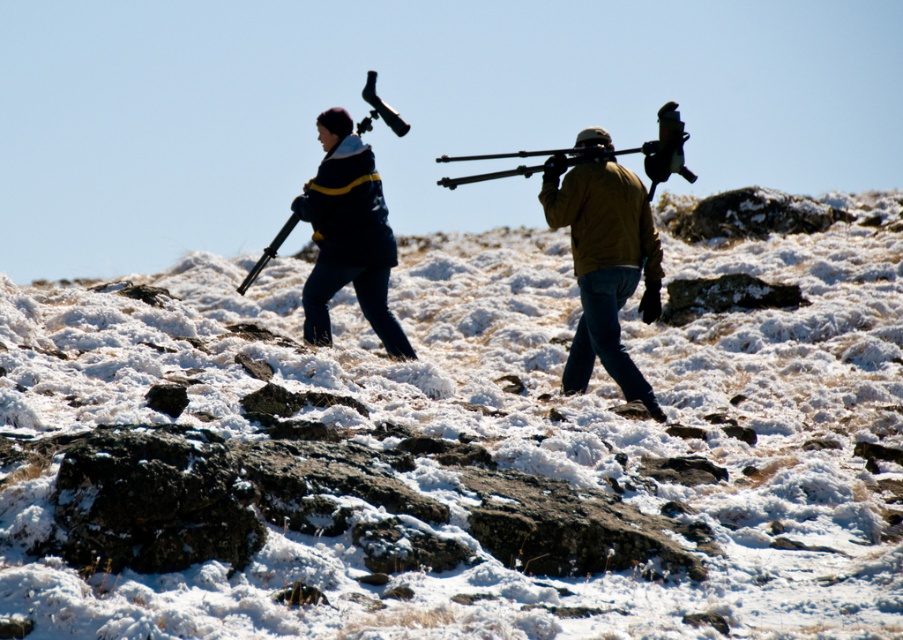
Looking at this image, is matte black jacket at center bigger than matte black rifle at center?

No, matte black jacket at center is not bigger than matte black rifle at center.

Can you confirm if matte black jacket at center is positioned above matte black rifle at center?

No, matte black jacket at center is not above matte black rifle at center.

Describe the element at coordinates (347, 234) in the screenshot. I see `matte black jacket at center` at that location.

Locate an element on the screen. The image size is (903, 640). matte black jacket at center is located at coordinates (347, 234).

Is the position of white fluffy snow at center more distant than that of matte black jacket at center?

That is False.

I want to click on white fluffy snow at center, so click(458, 451).

In the scene shown: Is brown leather jacket at center thinner than matte black jacket at center?

Indeed, brown leather jacket at center has a lesser width compared to matte black jacket at center.

Which is in front, point (610, 371) or point (337, 196)?

Point (610, 371) is in front.

I want to click on brown leather jacket at center, so click(x=604, y=266).